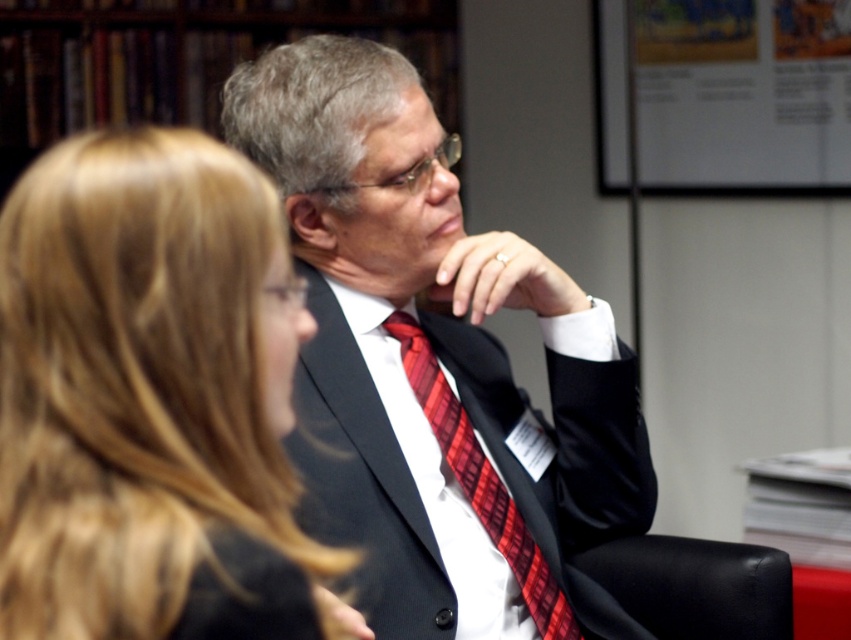
Between matte black suit at center and black leather chair at lower right, which one is positioned lower?

black leather chair at lower right is lower down.

Find the location of a particular element. matte black suit at center is located at coordinates (433, 364).

Consider the image. Is black leather chair at lower right below red plaid tie at center?

Yes, black leather chair at lower right is below red plaid tie at center.

Can you confirm if black leather chair at lower right is smaller than red plaid tie at center?

Correct, black leather chair at lower right occupies less space than red plaid tie at center.

Find the location of a particular element. This screenshot has width=851, height=640. black leather chair at lower right is located at coordinates (695, 586).

I want to click on matte black suit at center, so click(433, 364).

Which is more to the right, matte black suit at center or blonde hair at upper left?

matte black suit at center is more to the right.

Is point (523, 404) behind point (43, 218)?

Yes, point (523, 404) is farther from viewer.

The height and width of the screenshot is (640, 851). Find the location of `matte black suit at center`. matte black suit at center is located at coordinates (433, 364).